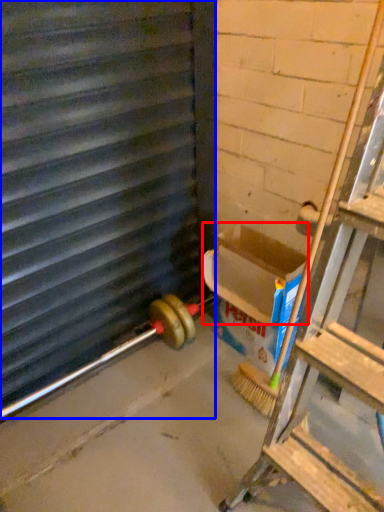
Question: Which object is closer to the camera taking this photo, box (highlighted by a red box) or window frame (highlighted by a blue box)?

Choices:
 (A) box
 (B) window frame

Answer: (B)